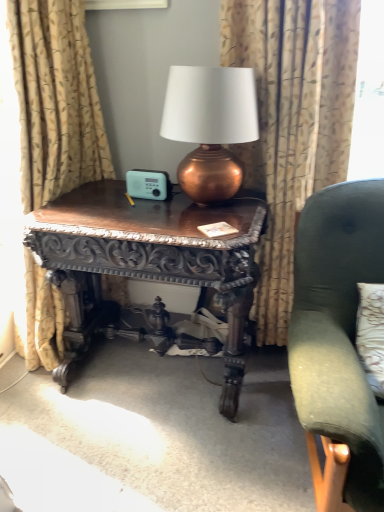
Question: From the image's perspective, is velvet green armchair at right over copper metallic lamp at center?

Choices:
 (A) no
 (B) yes

Answer: (A)

Question: From a real-world perspective, is velvet green armchair at right located beneath copper metallic lamp at center?

Choices:
 (A) no
 (B) yes

Answer: (B)

Question: Is the position of velvet green armchair at right more distant than that of copper metallic lamp at center?

Choices:
 (A) no
 (B) yes

Answer: (A)

Question: Is velvet green armchair at right positioned in front of copper metallic lamp at center?

Choices:
 (A) no
 (B) yes

Answer: (B)

Question: From the image's perspective, is velvet green armchair at right under copper metallic lamp at center?

Choices:
 (A) yes
 (B) no

Answer: (A)

Question: Looking at the image, does gold textured curtain at left, positioned as the first curtain in left-to-right order, seem bigger or smaller compared to patterned fabric curtain at center, which is the 2th curtain in left-to-right order?

Choices:
 (A) big
 (B) small

Answer: (A)

Question: From their relative heights in the image, would you say gold textured curtain at left, the 2th curtain in the right-to-left sequence, is taller or shorter than patterned fabric curtain at center, the 1th curtain from the right?

Choices:
 (A) tall
 (B) short

Answer: (A)

Question: From a real-world perspective, is gold textured curtain at left, positioned as the first curtain in left-to-right order, physically located above or below patterned fabric curtain at center, which is the 2th curtain in left-to-right order?

Choices:
 (A) below
 (B) above

Answer: (A)

Question: From the image's perspective, is gold textured curtain at left, the 2th curtain in the right-to-left sequence, located above or below patterned fabric curtain at center, the 1th curtain from the right?

Choices:
 (A) below
 (B) above

Answer: (B)

Question: In the image, is patterned fabric curtain at center, which is the 2th curtain in left-to-right order, positioned in front of or behind velvet green armchair at right?

Choices:
 (A) front
 (B) behind

Answer: (B)

Question: Is patterned fabric curtain at center, which is the 2th curtain in left-to-right order, to the left or to the right of velvet green armchair at right in the image?

Choices:
 (A) left
 (B) right

Answer: (A)

Question: In terms of height, does patterned fabric curtain at center, the 1th curtain from the right, look taller or shorter compared to velvet green armchair at right?

Choices:
 (A) short
 (B) tall

Answer: (B)

Question: In terms of width, does patterned fabric curtain at center, which is the 2th curtain in left-to-right order, look wider or thinner when compared to velvet green armchair at right?

Choices:
 (A) thin
 (B) wide

Answer: (A)

Question: In the image, is dark wood carved table at center positioned in front of or behind velvet green armchair at right?

Choices:
 (A) behind
 (B) front

Answer: (A)

Question: Considering the positions of dark wood carved table at center and velvet green armchair at right in the image, is dark wood carved table at center taller or shorter than velvet green armchair at right?

Choices:
 (A) tall
 (B) short

Answer: (B)